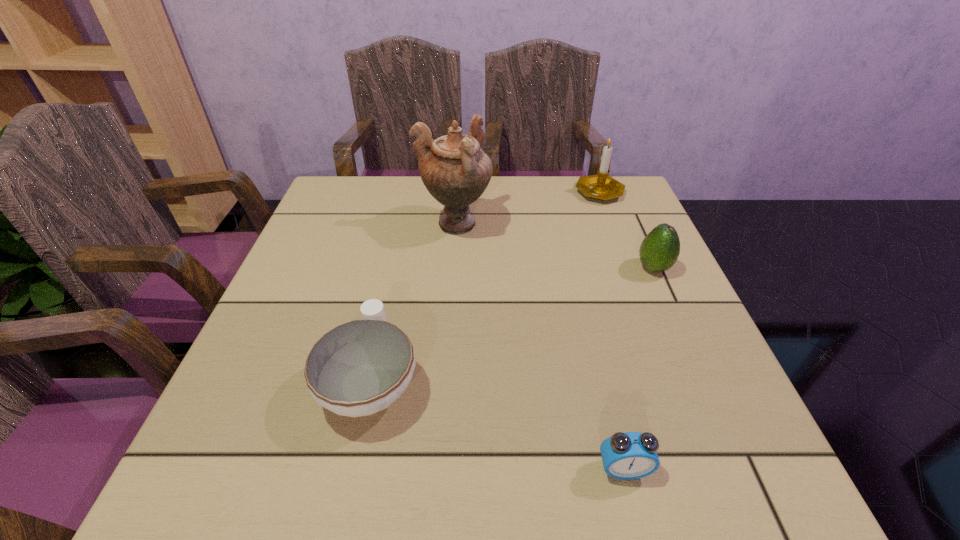
I want to click on free space at the far edge, so click(438, 205).

In the image, there is a desktop. Where is `free region at the left edge`? This screenshot has height=540, width=960. free region at the left edge is located at coordinates (210, 430).

I want to click on free spot at the right edge of the desktop, so click(x=616, y=269).

You are a GUI agent. You are given a task and a screenshot of the screen. Output one action in this format:
    pyautogui.click(x=<x>, y=<y>)
    Task: Click on the vacant space at the far left corner of the desktop
    This screenshot has height=540, width=960.
    Given the screenshot: What is the action you would take?
    pyautogui.click(x=370, y=209)

What are the coordinates of `vacant space at the near left corner of the desktop` in the screenshot? It's located at (212, 484).

At what (x,y) coordinates should I click in order to perform the action: click on vacant space at the near right corner of the desktop. Please return your answer as a coordinate pair (x, y). Looking at the image, I should click on (700, 500).

This screenshot has height=540, width=960. I want to click on free space between the avocado and the nearest object, so click(x=638, y=368).

The image size is (960, 540). In order to click on vacant space that is in between the alarm clock and the candle holder in this screenshot , I will do `click(612, 330)`.

Where is `free area in between the candle holder and the chinaware`? This screenshot has height=540, width=960. free area in between the candle holder and the chinaware is located at coordinates (485, 286).

This screenshot has height=540, width=960. I want to click on free space between the third nearest object and the urn, so click(554, 246).